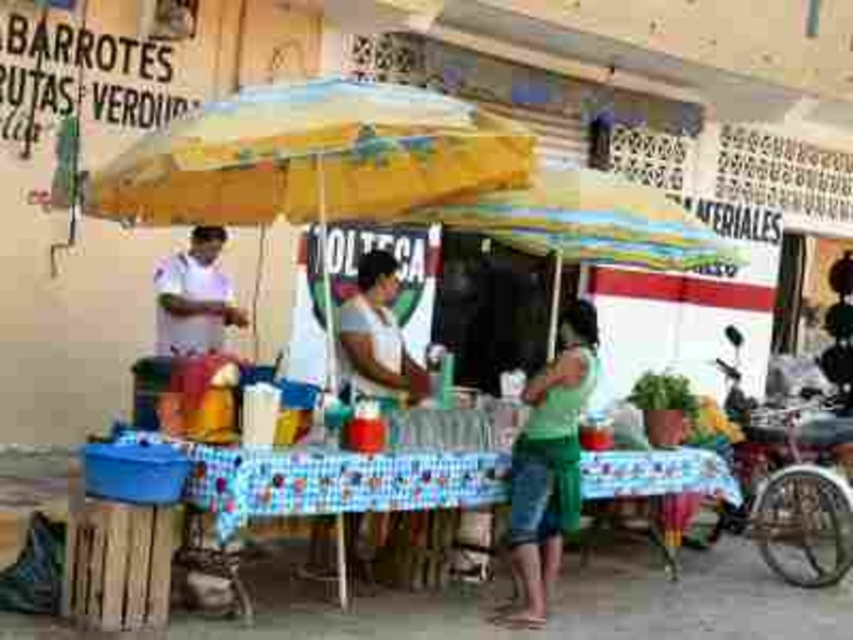
Question: Among these objects, which one is farthest from the camera?

Choices:
 (A) blue checkered tablecloth at center
 (B) white cotton shirt at center
 (C) green cotton shirt at center

Answer: (B)

Question: Is yellow fabric umbrella at center positioned before multicolored fabric umbrella at center?

Choices:
 (A) no
 (B) yes

Answer: (B)

Question: Can you confirm if yellow fabric umbrella at center is smaller than blue checkered tablecloth at center?

Choices:
 (A) no
 (B) yes

Answer: (A)

Question: Among these points, which one is nearest to the camera?

Choices:
 (A) (160, 291)
 (B) (570, 316)
 (C) (662, 204)
 (D) (352, 474)

Answer: (D)

Question: Can you confirm if yellow fabric umbrella at center is smaller than blue checkered tablecloth at center?

Choices:
 (A) yes
 (B) no

Answer: (B)

Question: Which point is farther to the camera?

Choices:
 (A) multicolored fabric umbrella at center
 (B) white cotton shirt at center
 (C) blue checkered tablecloth at center

Answer: (B)